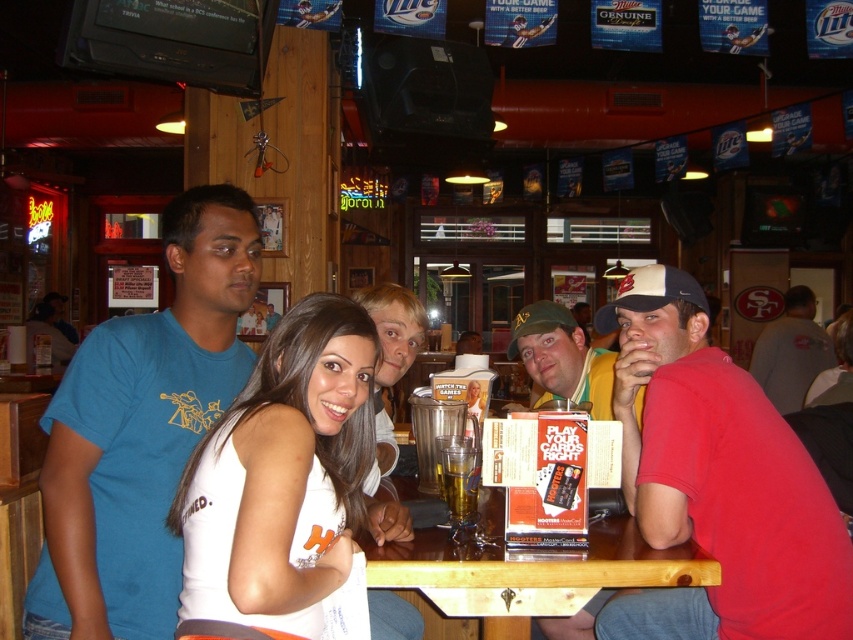
Who is more distant from viewer, (379, 412) or (541, 300)?

The point (541, 300) is more distant.

Between smooth white shirt at center and green fabric baseball cap at center, which one is positioned higher?

green fabric baseball cap at center is higher up.

You are a GUI agent. You are given a task and a screenshot of the screen. Output one action in this format:
    pyautogui.click(x=<x>, y=<y>)
    Task: Click on the smooth white shirt at center
    
    Given the screenshot: What is the action you would take?
    pyautogui.click(x=390, y=360)

At what (x,y) coordinates should I click in order to perform the action: click on gray fabric shirt at right. Please return your answer as a coordinate pair (x, y). Image resolution: width=853 pixels, height=640 pixels. Looking at the image, I should click on (791, 352).

Does gray fabric shirt at right lie behind white fabric baseball cap at upper right?

Yes, it is.

Locate an element on the screen. The image size is (853, 640). gray fabric shirt at right is located at coordinates (791, 352).

Who is more distant from viewer, [212,220] or [431,604]?

The point [431,604] is more distant.

Who is shorter, blue cotton t-shirt at left or wooden at center?

wooden at center

Is point (216, 307) farther from camera compared to point (602, 582)?

That is True.

Where is `blue cotton t-shirt at left`? The height and width of the screenshot is (640, 853). blue cotton t-shirt at left is located at coordinates (141, 429).